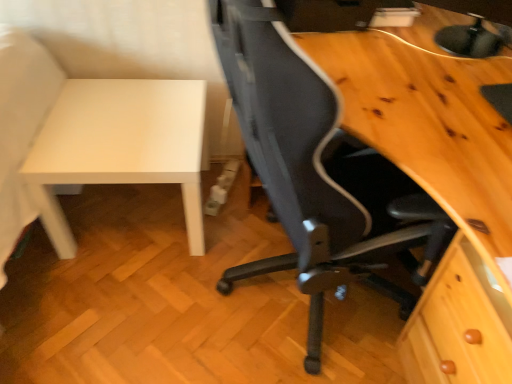
This screenshot has width=512, height=384. In order to click on white matte table at left in this screenshot , I will do `click(120, 146)`.

This screenshot has width=512, height=384. I want to click on black mesh chair at center, so pyautogui.click(x=317, y=171).

What is the approximate height of black mesh chair at center?

It is 29.95 inches.

Where is `matte black monitor at upper right`? matte black monitor at upper right is located at coordinates (472, 26).

From the picture: Does matte black monitor at upper right turn towards black mesh chair at center?

No, matte black monitor at upper right is not turned towards black mesh chair at center.

Image resolution: width=512 pixels, height=384 pixels. What are the coordinates of `chair lying below the matte black monitor at upper right (from the image's perspective)` in the screenshot? It's located at (317, 171).

How far apart are matte black monitor at upper right and black mesh chair at center?

A distance of 25.32 inches exists between matte black monitor at upper right and black mesh chair at center.

From the image's perspective, is white matte table at left located beneath black mesh chair at center?

No, from the image's perspective, white matte table at left is not below black mesh chair at center.

Is white matte table at left not close to black mesh chair at center?

They are positioned close to each other.

How different are the orientations of white matte table at left and black mesh chair at center in degrees?

The angular difference between white matte table at left and black mesh chair at center is 89.3 degrees.

Who is taller, white matte table at left or black mesh chair at center?

black mesh chair at center is taller.

Considering their positions, is matte black monitor at upper right located in front of or behind white matte table at left?

Visually, matte black monitor at upper right is located in front of white matte table at left.

Is matte black monitor at upper right to the left or to the right of white matte table at left in the image?

matte black monitor at upper right is to the right of white matte table at left.

From a real-world perspective, is matte black monitor at upper right under white matte table at left?

No, from a real-world perspective, matte black monitor at upper right is not beneath white matte table at left.

Who is bigger, matte black monitor at upper right or white matte table at left?

With larger size is white matte table at left.

Which object is closer to the camera taking this photo, white matte table at left or matte black monitor at upper right?

matte black monitor at upper right.

Is white matte table at left not near matte black monitor at upper right?

That's right, there is a large distance between white matte table at left and matte black monitor at upper right.

From the image's perspective, which object appears higher, white matte table at left or matte black monitor at upper right?

From the image's view, matte black monitor at upper right is above.

From a real-world perspective, does white matte table at left sit lower than matte black monitor at upper right?

Correct, in the physical world, white matte table at left is lower than matte black monitor at upper right.

Looking at this image, from a real-world perspective, is black mesh chair at center positioned above or below matte black monitor at upper right?

black mesh chair at center is below matte black monitor at upper right.

How many degrees apart are the facing directions of black mesh chair at center and matte black monitor at upper right?

There is a 51.4-degree angle between the facing directions of black mesh chair at center and matte black monitor at upper right.

Does black mesh chair at center have a greater height compared to matte black monitor at upper right?

Yes, black mesh chair at center is taller than matte black monitor at upper right.

This screenshot has height=384, width=512. In order to click on chair below the matte black monitor at upper right (from the image's perspective) in this screenshot , I will do `click(317, 171)`.

From a real-world perspective, which is physically below, black mesh chair at center or white matte table at left?

white matte table at left is physically lower.

Find the location of a particular element. The height and width of the screenshot is (384, 512). table on the left of black mesh chair at center is located at coordinates click(x=120, y=146).

Between point (349, 183) and point (198, 121), which one is positioned in front?

Positioned in front is point (349, 183).

Can you confirm if black mesh chair at center is smaller than white matte table at left?

No.

Locate an element on the screen. chair in front of the matte black monitor at upper right is located at coordinates (317, 171).

Locate an element on the screen. This screenshot has width=512, height=384. table above the black mesh chair at center (from the image's perspective) is located at coordinates (120, 146).

Considering their positions, is black mesh chair at center positioned closer to matte black monitor at upper right than white matte table at left?

black mesh chair at center is positioned closer to the anchor matte black monitor at upper right.

Based on their spatial positions, is white matte table at left or matte black monitor at upper right closer to black mesh chair at center?

white matte table at left is positioned closer to the anchor black mesh chair at center.

Which object lies nearer to the anchor point black mesh chair at center, matte black monitor at upper right or white matte table at left?

The object closer to black mesh chair at center is white matte table at left.

Looking at the image, which one is located closer to matte black monitor at upper right, white matte table at left or black mesh chair at center?

black mesh chair at center lies closer to matte black monitor at upper right than the other object.

Which object lies further to the anchor point white matte table at left, matte black monitor at upper right or black mesh chair at center?

Among the two, matte black monitor at upper right is located further to white matte table at left.

When comparing their distances from white matte table at left, does black mesh chair at center or matte black monitor at upper right seem further?

Among the two, matte black monitor at upper right is located further to white matte table at left.

Locate an element on the screen. Image resolution: width=512 pixels, height=384 pixels. chair between white matte table at left and matte black monitor at upper right from left to right is located at coordinates (317, 171).